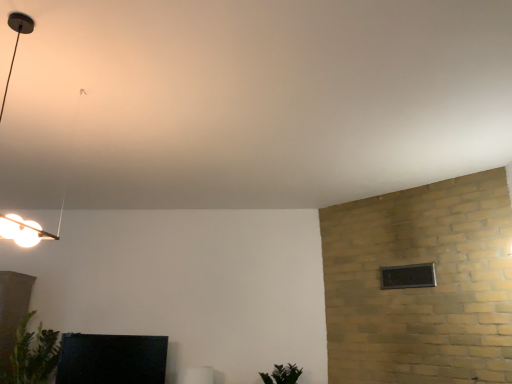
How much space does white glossy frame at lower center, arranged as the 1th furniture when viewed from the right, occupy horizontally?

It is 11.53 inches.

The width and height of the screenshot is (512, 384). What do you see at coordinates (408, 276) in the screenshot? I see `black glass window at upper right` at bounding box center [408, 276].

The height and width of the screenshot is (384, 512). In order to click on white glossy frame at lower center, the 2th furniture in the left-to-right sequence in this screenshot , I will do `click(196, 375)`.

This screenshot has height=384, width=512. I want to click on lamp above the white glossy frame at lower center, the 2th furniture in the left-to-right sequence (from the image's perspective), so click(23, 231).

Is white glossy frame at lower center, the 2th furniture in the left-to-right sequence, far from matte black lamp at upper left?

Absolutely, white glossy frame at lower center, the 2th furniture in the left-to-right sequence, is distant from matte black lamp at upper left.

Considering the relative sizes of white glossy frame at lower center, arranged as the 1th furniture when viewed from the right, and matte black lamp at upper left in the image provided, is white glossy frame at lower center, arranged as the 1th furniture when viewed from the right, thinner than matte black lamp at upper left?

Yes.

Between white glossy frame at lower center, the 2th furniture in the left-to-right sequence, and matte black lamp at upper left, which one has larger size?

With larger size is matte black lamp at upper left.

Is the position of black glass window at upper right less distant than that of matte black tv at lower left, which is counted as the 1th furniture, starting from the left?

That is True.

In the scene shown: Is black glass window at upper right spatially inside matte black tv at lower left, which is counted as the 1th furniture, starting from the left, or outside of it?

black glass window at upper right is located beyond the bounds of matte black tv at lower left, which is counted as the 1th furniture, starting from the left.

Is black glass window at upper right far from matte black tv at lower left, the 2th furniture from the right?

That's right, there is a large distance between black glass window at upper right and matte black tv at lower left, the 2th furniture from the right.

Is black glass window at upper right smaller than matte black tv at lower left, the 2th furniture from the right?

Yes, black glass window at upper right is smaller than matte black tv at lower left, the 2th furniture from the right.

Considering the relative positions of green leafy plant at lower left, positioned as the 2th plant in right-to-left order, and matte black lamp at upper left in the image provided, is green leafy plant at lower left, positioned as the 2th plant in right-to-left order, to the right of matte black lamp at upper left from the viewer's perspective?

No.

From the image's perspective, between green leafy plant at lower left, positioned as the 2th plant in right-to-left order, and matte black lamp at upper left, who is located below?

green leafy plant at lower left, positioned as the 2th plant in right-to-left order, appears lower in the image.

Which of these two, green leafy plant at lower left, positioned as the 2th plant in right-to-left order, or matte black lamp at upper left, is wider?

matte black lamp at upper left is wider.

Which is nearer, (24, 354) or (28, 225)?

Point (24, 354) is positioned farther from the camera compared to point (28, 225).

Does black glass window at upper right have a larger size compared to matte black lamp at upper left?

Incorrect, black glass window at upper right is not larger than matte black lamp at upper left.

From a real-world perspective, who is located higher, black glass window at upper right or matte black lamp at upper left?

matte black lamp at upper left is physically above.

Which is closer to the camera, (408, 285) or (13, 230)?

Point (408, 285) is farther from the camera than point (13, 230).

Considering their positions, is black glass window at upper right located in front of or behind green leafy plant at lower left, positioned as the 2th plant in right-to-left order?

In the image, black glass window at upper right appears in front of green leafy plant at lower left, positioned as the 2th plant in right-to-left order.

Between black glass window at upper right and green leafy plant at lower left, positioned as the 2th plant in right-to-left order, which one has larger size?

green leafy plant at lower left, positioned as the 2th plant in right-to-left order, is bigger.

From the image's perspective, is black glass window at upper right located above or below green leafy plant at lower left, acting as the first plant starting from the left?

Based on their image positions, black glass window at upper right is located above green leafy plant at lower left, acting as the first plant starting from the left.

In order to click on window in front of the green leafy plant at lower left, positioned as the 2th plant in right-to-left order in this screenshot , I will do `click(408, 276)`.

Which object is thinner, green matte plant at lower center, the first plant when ordered from right to left, or green leafy plant at lower left, acting as the first plant starting from the left?

Thinner between the two is green matte plant at lower center, the first plant when ordered from right to left.

Between green matte plant at lower center, which ranks as the second plant in left-to-right order, and green leafy plant at lower left, acting as the first plant starting from the left, which one has more height?

green leafy plant at lower left, acting as the first plant starting from the left, is taller.

Is green leafy plant at lower left, acting as the first plant starting from the left, completely or partially inside green matte plant at lower center, which ranks as the second plant in left-to-right order?

That's incorrect, green leafy plant at lower left, acting as the first plant starting from the left, is not inside green matte plant at lower center, which ranks as the second plant in left-to-right order.

From the image's perspective, which is above, green matte plant at lower center, the first plant when ordered from right to left, or green leafy plant at lower left, acting as the first plant starting from the left?

green leafy plant at lower left, acting as the first plant starting from the left, from the image's perspective.

Considering the sizes of green matte plant at lower center, the first plant when ordered from right to left, and black glass window at upper right in the image, is green matte plant at lower center, the first plant when ordered from right to left, wider or thinner than black glass window at upper right?

green matte plant at lower center, the first plant when ordered from right to left, is wider than black glass window at upper right.

Which is behind, point (270, 375) or point (425, 267)?

Point (270, 375)

Is green matte plant at lower center, the first plant when ordered from right to left, inside or outside of black glass window at upper right?

green matte plant at lower center, the first plant when ordered from right to left, cannot be found inside black glass window at upper right.

The height and width of the screenshot is (384, 512). I want to click on lamp located above the white glossy frame at lower center, the 2th furniture in the left-to-right sequence (from the image's perspective), so point(23,231).

Locate an element on the screen. window on the right of matte black tv at lower left, the 2th furniture from the right is located at coordinates point(408,276).

When comparing their distances from white glossy frame at lower center, the 2th furniture in the left-to-right sequence, does green matte plant at lower center, the first plant when ordered from right to left, or green leafy plant at lower left, positioned as the 2th plant in right-to-left order, seem closer?

green matte plant at lower center, the first plant when ordered from right to left, is closer to white glossy frame at lower center, the 2th furniture in the left-to-right sequence.

Estimate the real-world distances between objects in this image. Which object is further from black glass window at upper right, white glossy frame at lower center, arranged as the 1th furniture when viewed from the right, or green leafy plant at lower left, acting as the first plant starting from the left?

green leafy plant at lower left, acting as the first plant starting from the left, is positioned further to the anchor black glass window at upper right.

Which object lies further to the anchor point matte black lamp at upper left, green matte plant at lower center, which ranks as the second plant in left-to-right order, or white glossy frame at lower center, arranged as the 1th furniture when viewed from the right?

Based on the image, green matte plant at lower center, which ranks as the second plant in left-to-right order, appears to be further to matte black lamp at upper left.

From the image, which object appears to be farther from green leafy plant at lower left, acting as the first plant starting from the left, black glass window at upper right or white glossy frame at lower center, the 2th furniture in the left-to-right sequence?

Based on the image, black glass window at upper right appears to be further to green leafy plant at lower left, acting as the first plant starting from the left.

When comparing their distances from matte black lamp at upper left, does black glass window at upper right or white glossy frame at lower center, arranged as the 1th furniture when viewed from the right, seem closer?

The object closer to matte black lamp at upper left is white glossy frame at lower center, arranged as the 1th furniture when viewed from the right.

Estimate the real-world distances between objects in this image. Which object is closer to black glass window at upper right, green matte plant at lower center, the first plant when ordered from right to left, or matte black lamp at upper left?

green matte plant at lower center, the first plant when ordered from right to left.

From the image, which object appears to be farther from white glossy frame at lower center, arranged as the 1th furniture when viewed from the right, matte black lamp at upper left or black glass window at upper right?

matte black lamp at upper left is positioned further to the anchor white glossy frame at lower center, arranged as the 1th furniture when viewed from the right.

From the picture: When comparing their distances from matte black lamp at upper left, does green matte plant at lower center, which ranks as the second plant in left-to-right order, or black glass window at upper right seem further?

The object further to matte black lamp at upper left is black glass window at upper right.

The width and height of the screenshot is (512, 384). In order to click on furniture located between green leafy plant at lower left, acting as the first plant starting from the left, and white glossy frame at lower center, arranged as the 1th furniture when viewed from the right, in the left-right direction in this screenshot , I will do `click(111, 359)`.

Image resolution: width=512 pixels, height=384 pixels. In order to click on furniture situated between matte black tv at lower left, the 2th furniture from the right, and green matte plant at lower center, which ranks as the second plant in left-to-right order, from left to right in this screenshot , I will do `click(196, 375)`.

The height and width of the screenshot is (384, 512). In order to click on furniture situated between matte black lamp at upper left and black glass window at upper right from left to right in this screenshot , I will do `click(196, 375)`.

This screenshot has height=384, width=512. What are the coordinates of `plant between matte black tv at lower left, which is counted as the 1th furniture, starting from the left, and black glass window at upper right` in the screenshot? It's located at (282, 374).